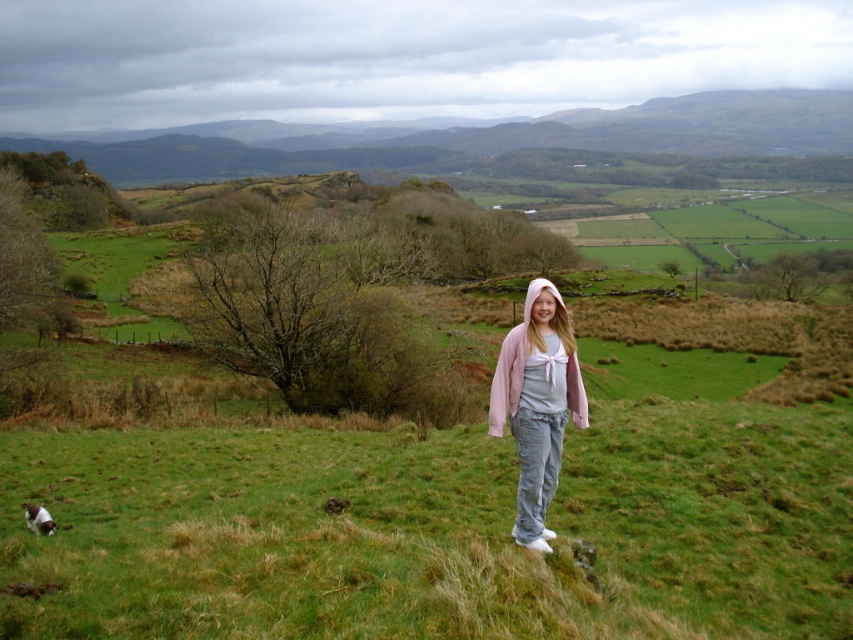
You are a photographer trying to capture the pink cotton hoodie at center and the green grassy hillside at upper center in a single shot. Which object will appear larger in the photo?

The green grassy hillside at upper center is positioned over the pink cotton hoodie at center, so it will appear larger in the photo due to its closer proximity to the camera.

You are a photographer trying to capture the girl in the pink cotton hoodie at center and the green grassy hillside at upper center in the same frame. Which object will appear closer to the camera in the photo?

The green grassy hillside at upper center will appear closer to the camera because it is in front of the pink cotton hoodie at center.

You are a drone operator who needs to capture a photo of both the green grassy hillside at upper center and the pink cotton hoodie at center. The minimum distance your drone can focus on two objects is 400 meters. Will your drone be able to capture both in focus?

The green grassy hillside at upper center and pink cotton hoodie at center are 467.41 meters apart from each other. Since the distance exceeds the drone minimum focusing distance of 400 meters, the drone will not be able to capture both in focus.